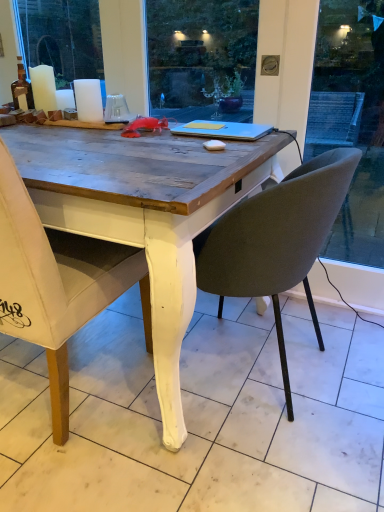
Question: Can you confirm if white matte candle at upper left, acting as the 1th candle starting from the right, is wider than blue matte laptop at center?

Choices:
 (A) no
 (B) yes

Answer: (A)

Question: Is white matte candle at upper left, acting as the 1th candle starting from the right, behind blue matte laptop at center?

Choices:
 (A) no
 (B) yes

Answer: (B)

Question: Are white matte candle at upper left, arranged as the 2th candle when viewed from the left, and blue matte laptop at center beside each other?

Choices:
 (A) yes
 (B) no

Answer: (B)

Question: Is white matte candle at upper left, arranged as the 2th candle when viewed from the left, positioned with its back to blue matte laptop at center?

Choices:
 (A) no
 (B) yes

Answer: (A)

Question: From a real-world perspective, is white matte candle at upper left, arranged as the 2th candle when viewed from the left, positioned over blue matte laptop at center based on gravity?

Choices:
 (A) yes
 (B) no

Answer: (A)

Question: From a real-world perspective, is white fabric chair at left, the 1th chair when ordered from left to right, positioned above or below white matte candle at upper left, which appears as the 1th candle when viewed from the left?

Choices:
 (A) below
 (B) above

Answer: (A)

Question: In terms of height, does white fabric chair at left, which is the second chair from right to left, look taller or shorter compared to white matte candle at upper left, which appears as the 1th candle when viewed from the left?

Choices:
 (A) short
 (B) tall

Answer: (B)

Question: In terms of size, does white fabric chair at left, the 1th chair when ordered from left to right, appear bigger or smaller than white matte candle at upper left, which ranks as the second candle in right-to-left order?

Choices:
 (A) small
 (B) big

Answer: (B)

Question: From the image's perspective, is white fabric chair at left, which is the second chair from right to left, positioned above or below white matte candle at upper left, which appears as the 1th candle when viewed from the left?

Choices:
 (A) above
 (B) below

Answer: (B)

Question: From the image's perspective, is matte gray chair at center, acting as the first chair starting from the right, above or below white matte candle at upper left, which ranks as the second candle in right-to-left order?

Choices:
 (A) below
 (B) above

Answer: (A)

Question: Considering the positions of matte gray chair at center, the second chair from the left, and white matte candle at upper left, which ranks as the second candle in right-to-left order, in the image, is matte gray chair at center, the second chair from the left, taller or shorter than white matte candle at upper left, which ranks as the second candle in right-to-left order,?

Choices:
 (A) tall
 (B) short

Answer: (A)

Question: Considering the positions of point (319, 245) and point (34, 81), is point (319, 245) closer or farther from the camera than point (34, 81)?

Choices:
 (A) closer
 (B) farther

Answer: (A)

Question: Is matte gray chair at center, the second chair from the left, wider or thinner than white matte candle at upper left, which ranks as the second candle in right-to-left order?

Choices:
 (A) thin
 (B) wide

Answer: (B)

Question: In terms of height, does white matte candle at upper left, which ranks as the second candle in right-to-left order, look taller or shorter compared to white matte candle at upper left, acting as the 1th candle starting from the right?

Choices:
 (A) short
 (B) tall

Answer: (B)

Question: Considering the positions of white matte candle at upper left, which appears as the 1th candle when viewed from the left, and white matte candle at upper left, acting as the 1th candle starting from the right, in the image, is white matte candle at upper left, which appears as the 1th candle when viewed from the left, bigger or smaller than white matte candle at upper left, acting as the 1th candle starting from the right,?

Choices:
 (A) small
 (B) big

Answer: (B)